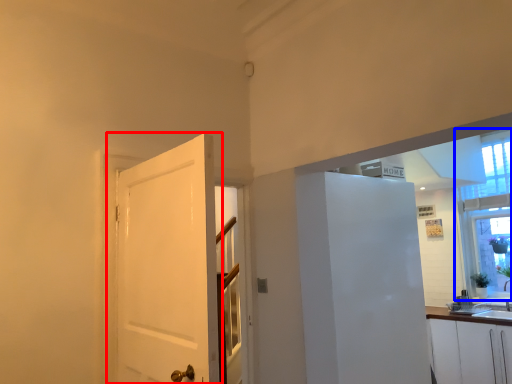
Question: Which of the following is the farthest to the observer, door (highlighted by a red box) or window (highlighted by a blue box)?

Choices:
 (A) door
 (B) window

Answer: (B)